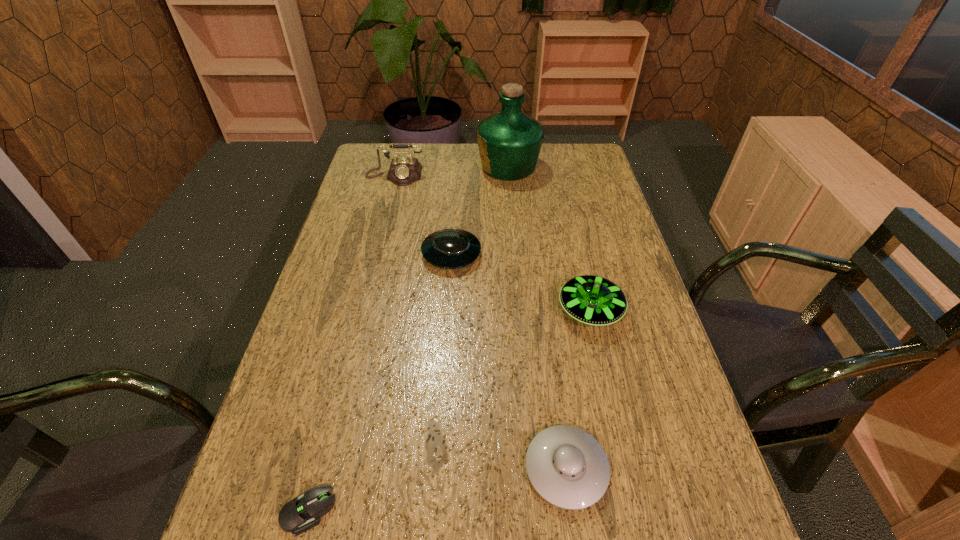
The height and width of the screenshot is (540, 960). Find the location of `object at the right edge`. object at the right edge is located at coordinates (593, 300).

Locate an element on the screen. object located at the far left corner is located at coordinates (403, 171).

I want to click on blank space at the far edge, so click(x=449, y=155).

Where is `vacant space at the left edge of the desktop`? The height and width of the screenshot is (540, 960). vacant space at the left edge of the desktop is located at coordinates (370, 211).

This screenshot has height=540, width=960. I want to click on vacant space at the right edge of the desktop, so click(621, 370).

What are the coordinates of `vacant region at the far right corner of the desktop` in the screenshot? It's located at (582, 170).

The height and width of the screenshot is (540, 960). I want to click on vacant area that lies between the telephone and the shortest object, so click(351, 344).

This screenshot has height=540, width=960. What are the coordinates of `vacant region between the shortest object and the nearest saucer` in the screenshot? It's located at (438, 490).

The image size is (960, 540). I want to click on free space between the nearest saucer and the computer mouse, so click(x=438, y=490).

The height and width of the screenshot is (540, 960). In order to click on vacant area that lies between the telephone and the nearest saucer in this screenshot , I will do `click(481, 322)`.